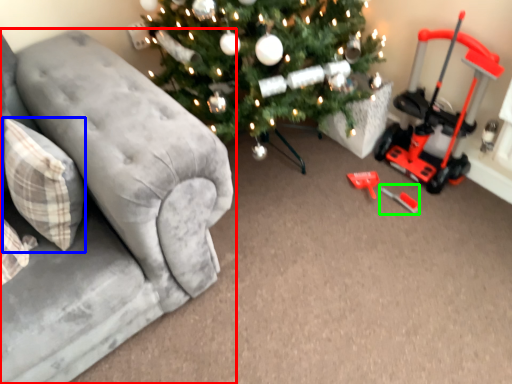
Question: Which object is the farthest from studio couch (highlighted by a red box)? Choose among these: pillow (highlighted by a blue box) or toy (highlighted by a green box).

Choices:
 (A) pillow
 (B) toy

Answer: (B)